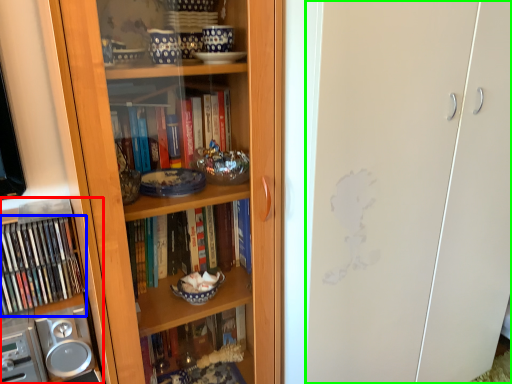
Question: Which is farther away from cabinet (highlighted by a red box)? book (highlighted by a blue box) or glass door (highlighted by a green box)?

Choices:
 (A) book
 (B) glass door

Answer: (B)